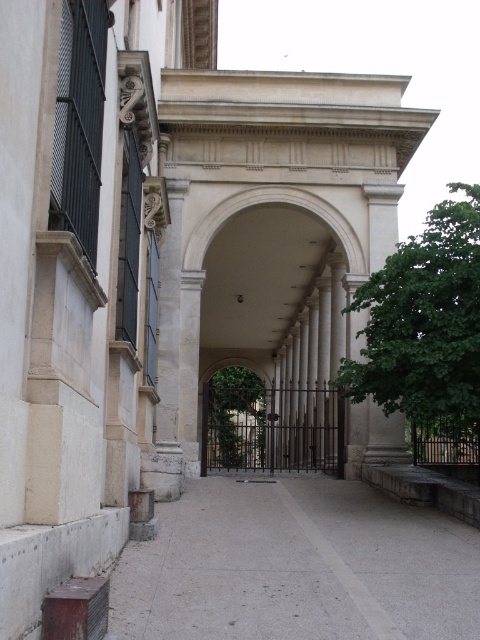
Question: Estimate the real-world distances between objects in this image. Which object is closer to the green leafy tree at center?

Choices:
 (A) green metal gate at center
 (B) gray concrete pavement at center

Answer: (B)

Question: Can you confirm if gray concrete pavement at center is smaller than green leafy tree at center?

Choices:
 (A) yes
 (B) no

Answer: (A)

Question: Does white stone archway at center have a greater width compared to green leafy tree at center?

Choices:
 (A) yes
 (B) no

Answer: (A)

Question: Based on their relative distances, which object is farther from the gray concrete pavement at center?

Choices:
 (A) green leafy tree at center
 (B) green metal gate at center
 (C) white stone archway at center

Answer: (C)

Question: Which point is farther from the camera taking this photo?

Choices:
 (A) click(x=157, y=513)
 (B) click(x=354, y=401)
 (C) click(x=235, y=429)
 (D) click(x=350, y=440)

Answer: (C)

Question: Considering the relative positions of green leafy tree at center and green metal gate at center in the image provided, where is green leafy tree at center located with respect to green metal gate at center?

Choices:
 (A) below
 (B) above

Answer: (B)